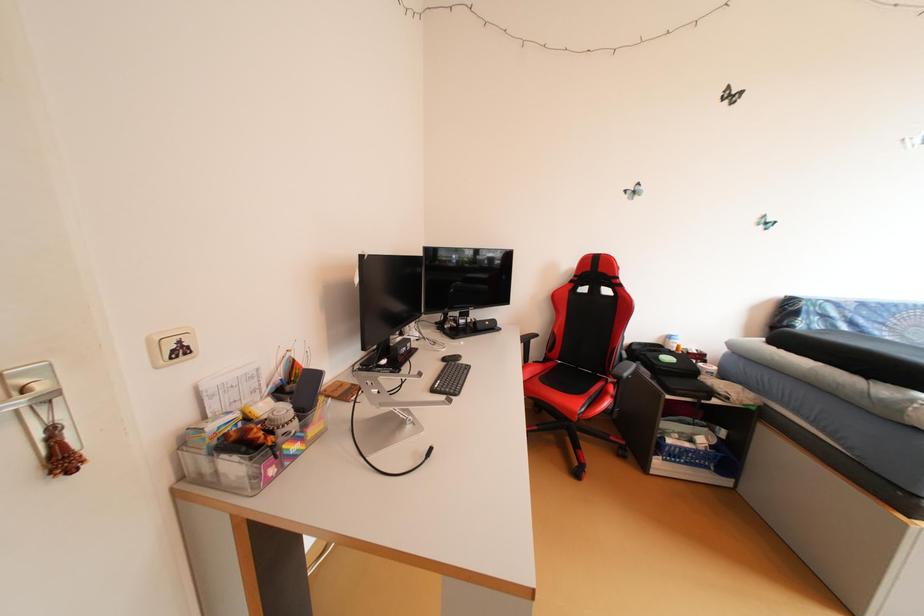
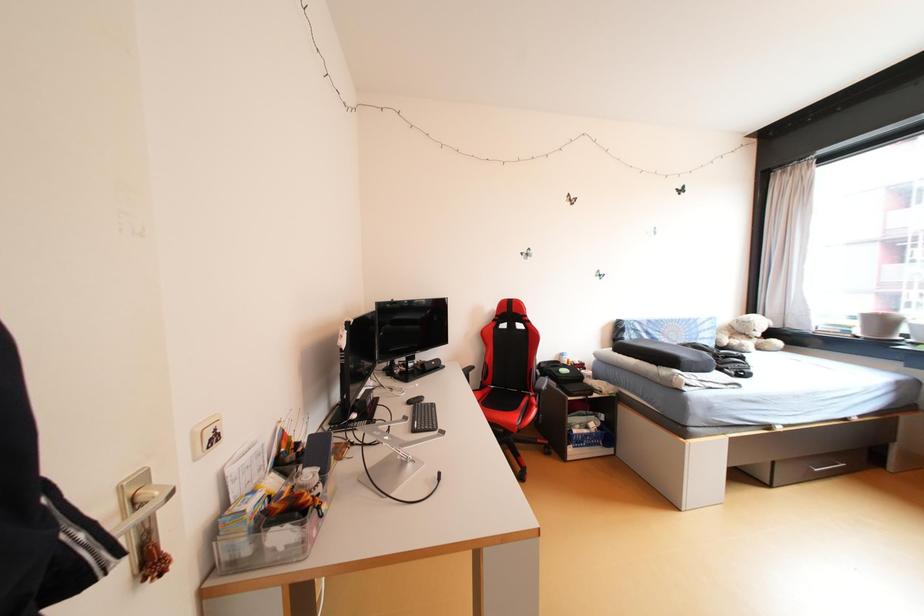
In a continuous first-person perspective shot, in which direction is the camera moving?

The cameraman moved toward left, backward.